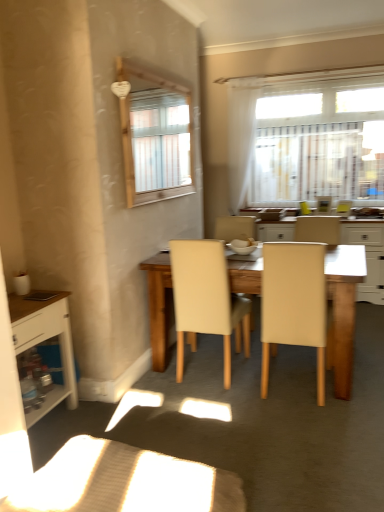
Locate an element on the screen. The height and width of the screenshot is (512, 384). empty space that is ontop of white sheer curtain at upper center (from a real-world perspective) is located at coordinates (246, 80).